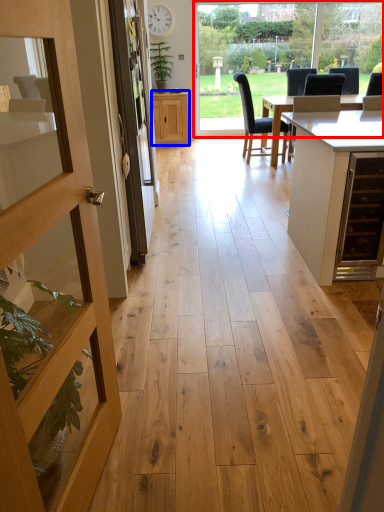
Question: Which object is closer to the camera taking this photo, window frame (highlighted by a red box) or cabinetry (highlighted by a blue box)?

Choices:
 (A) window frame
 (B) cabinetry

Answer: (A)